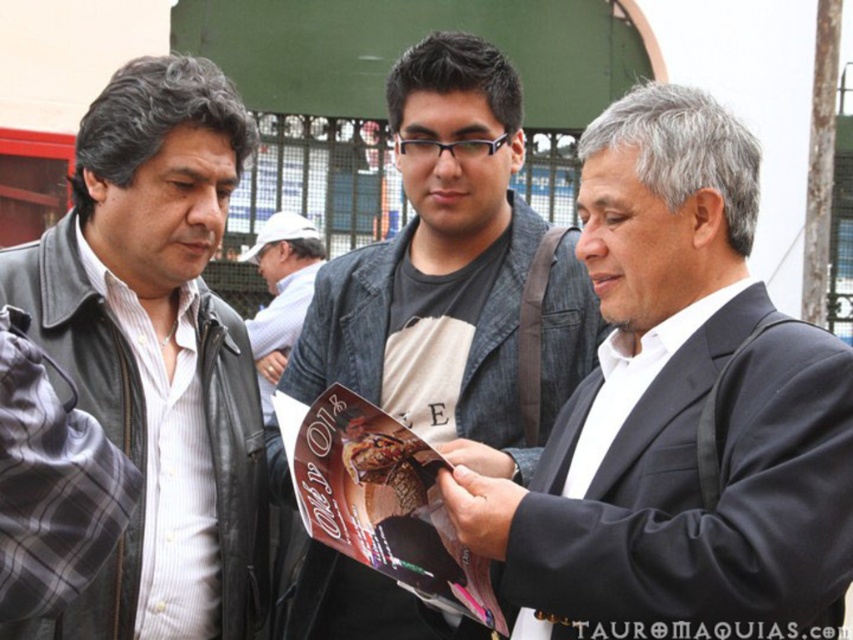
Question: Which of the following is the closest to the observer?

Choices:
 (A) matte paper magazine at center
 (B) black suit jacket at center
 (C) denim jacket at center

Answer: (B)

Question: Considering the real-world distances, which object is farthest from the light gray fabric shirt at center?

Choices:
 (A) denim jacket at center
 (B) matte paper magazine at center
 (C) leather jacket at left
 (D) black suit jacket at center

Answer: (D)

Question: Which point is farther to the camera?

Choices:
 (A) (712, 208)
 (B) (465, 285)
 (C) (413, 458)

Answer: (B)

Question: Is black suit jacket at center below matte paper magazine at center?

Choices:
 (A) no
 (B) yes

Answer: (A)

Question: Considering the relative positions of black suit jacket at center and matte paper magazine at center in the image provided, where is black suit jacket at center located with respect to matte paper magazine at center?

Choices:
 (A) below
 (B) above

Answer: (B)

Question: In this image, where is leather jacket at left located relative to matte paper magazine at center?

Choices:
 (A) left
 (B) right

Answer: (A)